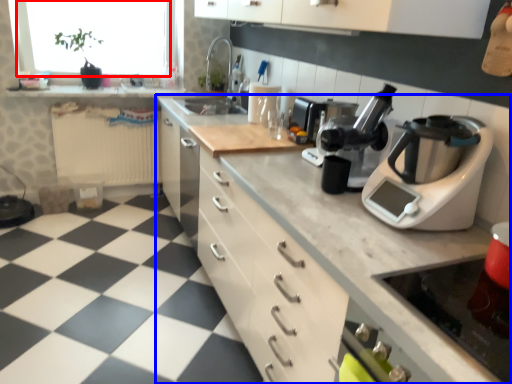
Question: Among these objects, which one is nearest to the camera, window screen (highlighted by a red box) or countertop (highlighted by a blue box)?

Choices:
 (A) window screen
 (B) countertop

Answer: (B)